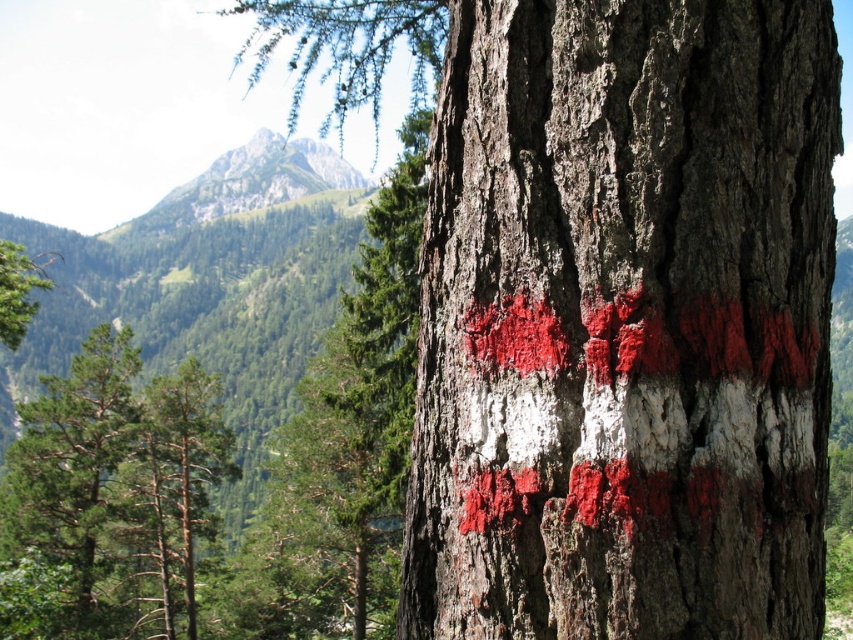
Question: Is smooth bark tree trunk at center closer to the viewer compared to green grassy mountain at upper center?

Choices:
 (A) no
 (B) yes

Answer: (B)

Question: Among these objects, which one is nearest to the camera?

Choices:
 (A) green grassy mountain at upper center
 (B) green rough bark tree at left
 (C) smooth bark tree trunk at center

Answer: (C)

Question: Can you confirm if smooth bark tree trunk at center is smaller than green grassy mountain at upper center?

Choices:
 (A) no
 (B) yes

Answer: (B)

Question: Which of the following is the closest to the observer?

Choices:
 (A) (521, 8)
 (B) (84, 513)

Answer: (A)

Question: Among these points, which one is nearest to the camera?

Choices:
 (A) [305, 157]
 (B) [514, 384]
 (C) [16, 586]

Answer: (B)

Question: Does smooth bark tree trunk at center have a lesser width compared to green rough bark tree at left?

Choices:
 (A) no
 (B) yes

Answer: (B)